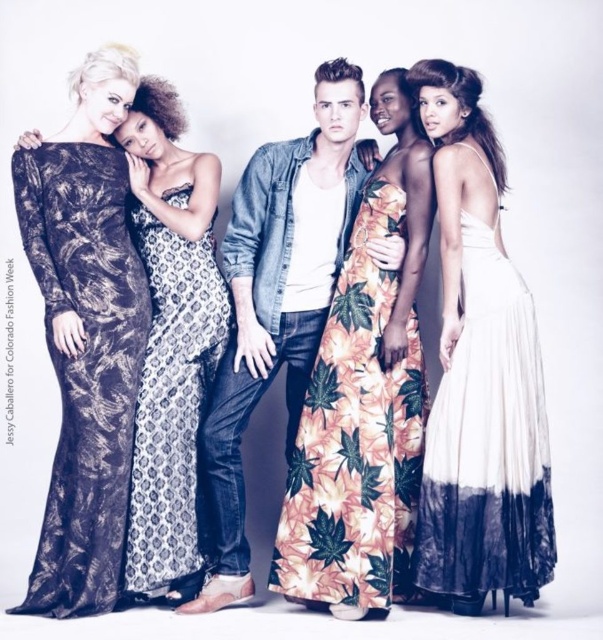
You are a photographer arranging two outfits for a photoshoot. You have a denim shirt at center and a printed silk dress at center. Which outfit is placed on top of the other?

The denim shirt at center is positioned over the printed silk dress at center, so it is placed on top.

Looking at this image, you are a photographer arranging two outfits for a photoshoot. The denim shirt at center and the printed silk dress at center are placed side by side. Which outfit takes up more horizontal space?

The denim shirt at center takes up more horizontal space than the printed silk dress at center because its width surpasses the dress.